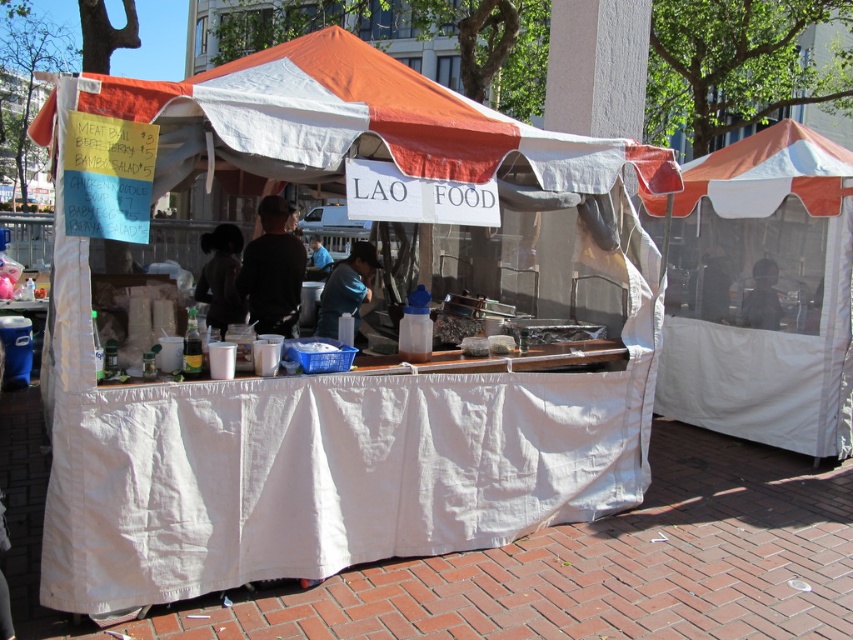
Is orange fabric canopy at center taller than blue fabric shirt at center?

Correct, orange fabric canopy at center is much taller as blue fabric shirt at center.

The width and height of the screenshot is (853, 640). What do you see at coordinates (367, 120) in the screenshot?
I see `orange fabric canopy at center` at bounding box center [367, 120].

Is point (285, 148) more distant than point (358, 252)?

No, (285, 148) is closer to viewer.

Where is `orange fabric canopy at center`? This screenshot has width=853, height=640. orange fabric canopy at center is located at coordinates click(367, 120).

Looking at this image, does black matte shirt at center appear on the right side of dark matte face at upper right?

Incorrect, black matte shirt at center is not on the right side of dark matte face at upper right.

Is black matte shirt at center positioned in front of dark matte face at upper right?

Yes, it is.

Identify the location of black matte shirt at center. Image resolution: width=853 pixels, height=640 pixels. click(x=271, y=269).

Can you confirm if black matte shirt at center is wider than dark hair at center?

No, black matte shirt at center is not wider than dark hair at center.

Between black matte shirt at center and dark hair at center, which one has more height?

black matte shirt at center

Does point (283, 314) lie in front of point (202, 296)?

Yes, point (283, 314) is closer to viewer.

The height and width of the screenshot is (640, 853). What are the coordinates of `black matte shirt at center` in the screenshot? It's located at [x=271, y=269].